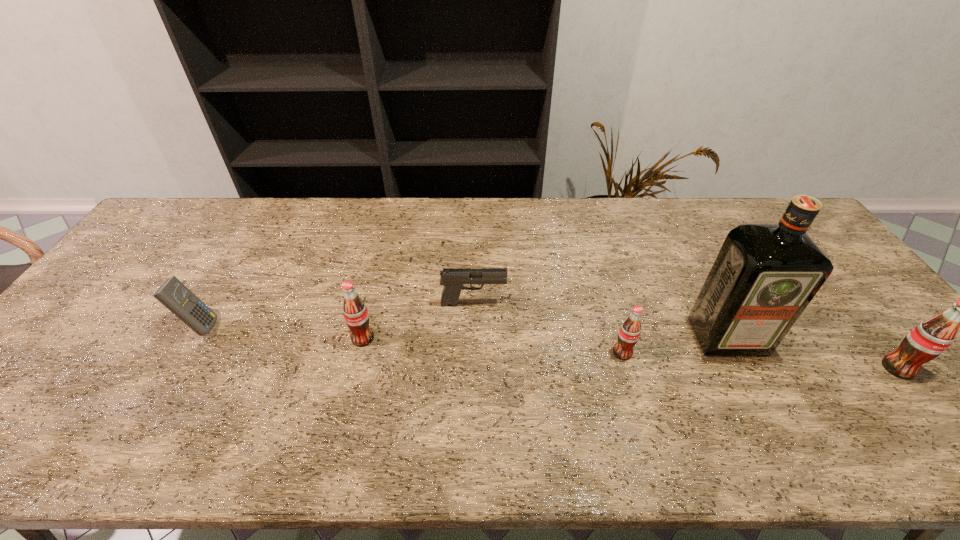
Considering the uniform spacing of sodas, where should an additional soda be positioned on the left? Please locate a free spot. Please provide its 2D coordinates. Your answer should be formatted as a tuple, i.e. [(x, y)], where the tuple contains the x and y coordinates of a point satisfying the conditions above.

[(118, 325)]